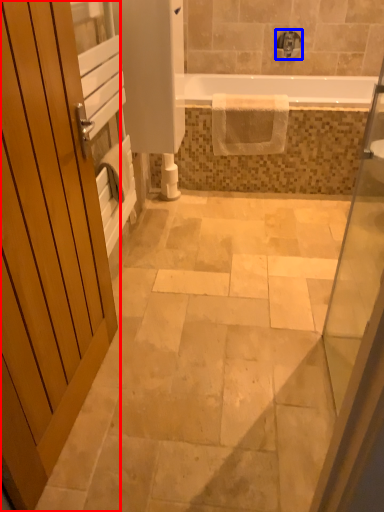
Question: Which object appears closest to the camera in this image, door (highlighted by a red box) or tap (highlighted by a blue box)?

Choices:
 (A) door
 (B) tap

Answer: (A)